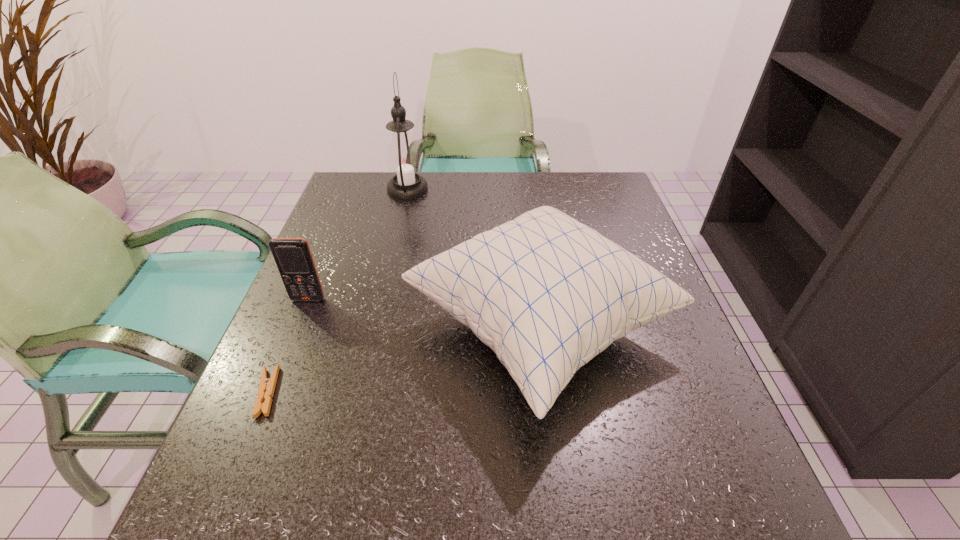
Locate an element on the screen. This screenshot has width=960, height=540. the farthest object is located at coordinates (404, 161).

The image size is (960, 540). I want to click on oil lamp, so click(x=404, y=161).

Identify the location of the second tallest object. (546, 293).

I want to click on cushion, so click(546, 293).

The width and height of the screenshot is (960, 540). What are the coordinates of `the third tallest object` in the screenshot? It's located at (293, 257).

Locate an element on the screen. the shortest object is located at coordinates (265, 393).

Identify the location of vacant space located on the front of the oil lamp. This screenshot has height=540, width=960. (397, 232).

Find the location of a particular element. The height and width of the screenshot is (540, 960). free space located on the left of the second tallest object is located at coordinates 355,327.

This screenshot has width=960, height=540. I want to click on blank space located 0.340m on the screen of the second shortest object, so click(x=243, y=460).

Where is `free space located 0.220m on the back of the clothespin`? free space located 0.220m on the back of the clothespin is located at coordinates (312, 286).